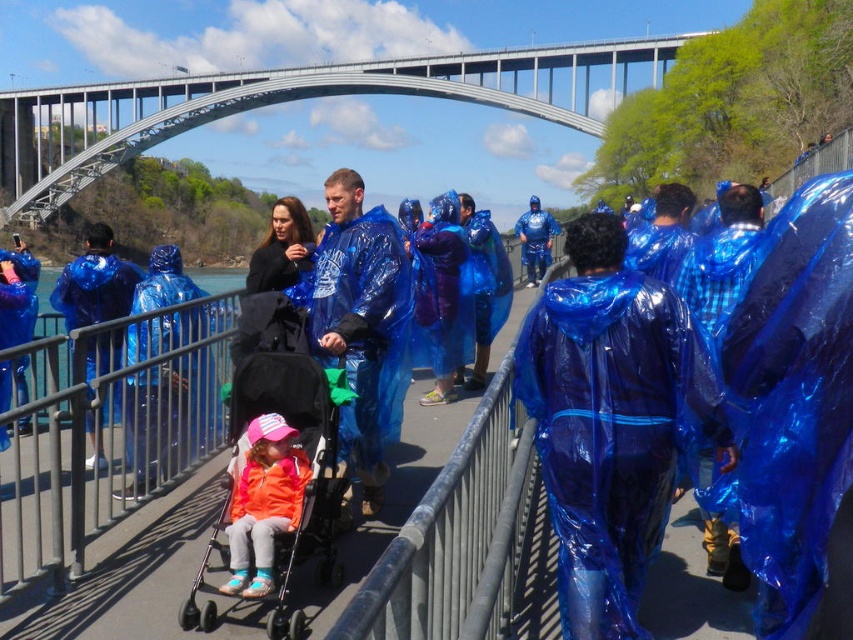
You are standing on the pedestrian bridge and want to reach the orange fabric stroller at center. Which direction should you move to get closer to it?

The orange fabric stroller at center is located at point coordinates, so you should move towards the center of the bridge to reach it.

You are standing at the entrance of the bridge and want to reach the metallic gray pedestrian bridge at upper center. Which direction should you walk to reach it?

The metallic gray pedestrian bridge at upper center is located at point (297, 99), so you should walk towards the upper center direction to reach it.

You are a photographer standing on the orange fabric stroller at center and want to take a photo of the metallic gray pedestrian bridge at upper center. Can you see the entire bridge in your viewfinder without moving your position?

The orange fabric stroller at center is behind metallic gray pedestrian bridge at upper center, so you cannot see the entire bridge in your viewfinder without moving your position because the stroller is blocking the view.